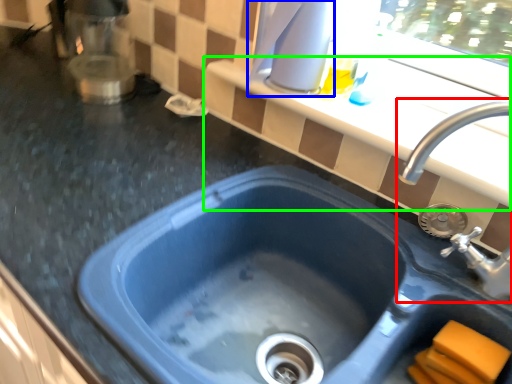
Question: Estimate the real-world distances between objects in this image. Which object is farther from sink (highlighted by a red box), appliance (highlighted by a blue box) or window sill (highlighted by a green box)?

Choices:
 (A) appliance
 (B) window sill

Answer: (A)